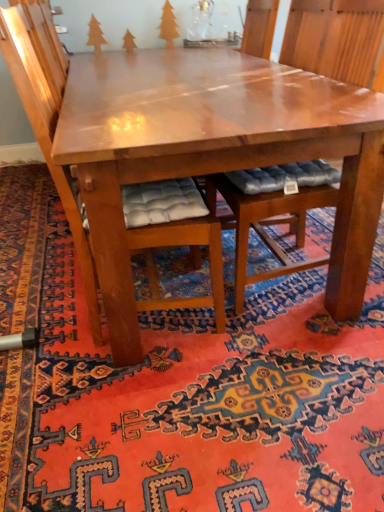
Question: Considering the relative positions of wooden tree at upper left, which is the first tree in left-to-right order, and wooden cushioned chair at center, the first chair in the left-to-right sequence, in the image provided, is wooden tree at upper left, which is the first tree in left-to-right order, in front of wooden cushioned chair at center, the first chair in the left-to-right sequence,?

Choices:
 (A) no
 (B) yes

Answer: (A)

Question: Does wooden tree at upper left, the third tree when ordered from right to left, have a greater width compared to wooden cushioned chair at center, acting as the second chair starting from the right?

Choices:
 (A) yes
 (B) no

Answer: (B)

Question: Does wooden tree at upper left, the third tree when ordered from right to left, have a lesser width compared to wooden cushioned chair at center, acting as the second chair starting from the right?

Choices:
 (A) yes
 (B) no

Answer: (A)

Question: Can you confirm if wooden tree at upper left, the third tree when ordered from right to left, is smaller than wooden cushioned chair at center, the first chair in the left-to-right sequence?

Choices:
 (A) yes
 (B) no

Answer: (A)

Question: From a real-world perspective, is wooden tree at upper left, the third tree when ordered from right to left, positioned under wooden cushioned chair at center, the first chair in the left-to-right sequence, based on gravity?

Choices:
 (A) yes
 (B) no

Answer: (B)

Question: In terms of height, does shiny brown table at center look taller or shorter compared to wooden cushioned chair at center, acting as the second chair starting from the right?

Choices:
 (A) short
 (B) tall

Answer: (A)

Question: Is shiny brown table at center bigger or smaller than wooden cushioned chair at center, acting as the second chair starting from the right?

Choices:
 (A) big
 (B) small

Answer: (A)

Question: Considering the positions of point (132, 357) and point (46, 103), is point (132, 357) closer or farther from the camera than point (46, 103)?

Choices:
 (A) closer
 (B) farther

Answer: (B)

Question: Is shiny brown table at center spatially inside wooden cushioned chair at center, the first chair in the left-to-right sequence, or outside of it?

Choices:
 (A) inside
 (B) outside

Answer: (B)

Question: From the image's perspective, is wooden tree at upper left, which is the first tree in left-to-right order, above or below orange matte tree at upper center, positioned as the third tree in left-to-right order?

Choices:
 (A) above
 (B) below

Answer: (B)

Question: In the image, is wooden tree at upper left, which is the first tree in left-to-right order, positioned in front of or behind orange matte tree at upper center, positioned as the third tree in left-to-right order?

Choices:
 (A) behind
 (B) front

Answer: (B)

Question: From a real-world perspective, is wooden tree at upper left, which is the first tree in left-to-right order, above or below orange matte tree at upper center, positioned as the third tree in left-to-right order?

Choices:
 (A) above
 (B) below

Answer: (B)

Question: Is wooden tree at upper left, which is the first tree in left-to-right order, inside the boundaries of orange matte tree at upper center, arranged as the first tree when viewed from the right, or outside?

Choices:
 (A) inside
 (B) outside

Answer: (B)

Question: Considering the relative positions of orange matte tree at upper center, arranged as the first tree when viewed from the right, and carpet with intricate patterns at center in the image provided, is orange matte tree at upper center, arranged as the first tree when viewed from the right, to the left or to the right of carpet with intricate patterns at center?

Choices:
 (A) left
 (B) right

Answer: (B)

Question: Based on their sizes in the image, would you say orange matte tree at upper center, arranged as the first tree when viewed from the right, is bigger or smaller than carpet with intricate patterns at center?

Choices:
 (A) big
 (B) small

Answer: (B)